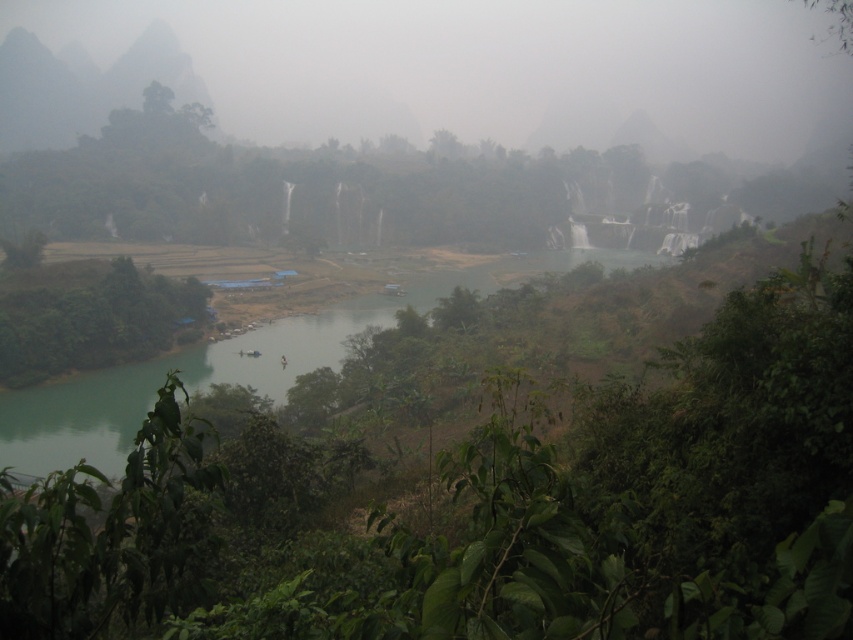
Question: Among these objects, which one is farthest from the camera?

Choices:
 (A) gray rock mountain at upper left
 (B) green leafy tree at center

Answer: (A)

Question: Can you confirm if green leafy tree at center is positioned above green leafy tree at lower left?

Choices:
 (A) no
 (B) yes

Answer: (A)

Question: Considering the relative positions of green leafy tree at lower left and gray rock mountain at upper left in the image provided, where is green leafy tree at lower left located with respect to gray rock mountain at upper left?

Choices:
 (A) right
 (B) left

Answer: (A)

Question: Which object appears farthest from the camera in this image?

Choices:
 (A) green leafy tree at center
 (B) foggy mist at upper center
 (C) green leafy tree at lower left
 (D) gray rock mountain at upper left

Answer: (B)

Question: Which is nearer to the green leafy tree at center?

Choices:
 (A) gray rock mountain at upper left
 (B) green leafy tree at lower left
 (C) foggy mist at upper center

Answer: (B)

Question: Does foggy mist at upper center appear on the left side of gray rock mountain at upper left?

Choices:
 (A) no
 (B) yes

Answer: (A)